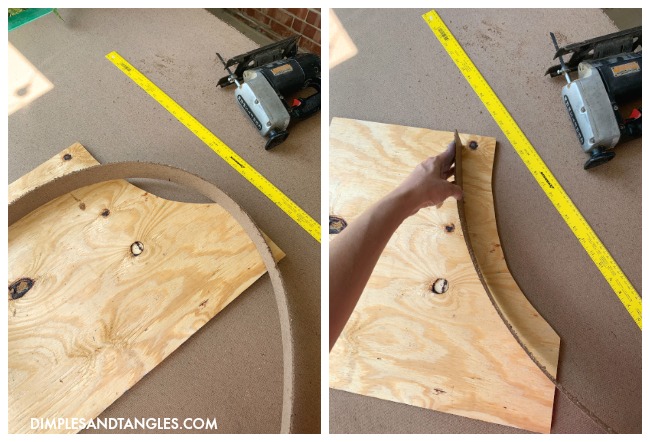
Locate an element on the screen. This screenshot has height=442, width=650. brick wall is located at coordinates (273, 18).